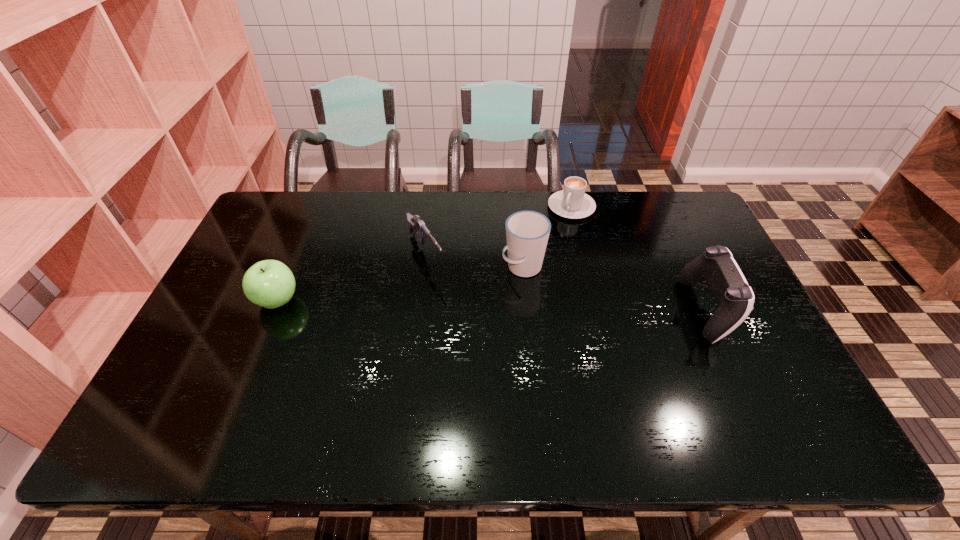
At what (x,y) coordinates should I click in order to perform the action: click on vacant space at the far edge. Please return your answer as a coordinate pair (x, y). This screenshot has width=960, height=540. Looking at the image, I should click on (396, 201).

In the image, there is a desktop. At what (x,y) coordinates should I click in order to perform the action: click on vacant space at the near edge. Please return your answer as a coordinate pair (x, y). Looking at the image, I should click on [563, 386].

Where is `vacant area at the right edge`? This screenshot has width=960, height=540. vacant area at the right edge is located at coordinates (704, 306).

This screenshot has height=540, width=960. Find the location of `vacant space at the far left corner`. vacant space at the far left corner is located at coordinates (266, 212).

Where is `free space at the near left corner of the desktop`? This screenshot has height=540, width=960. free space at the near left corner of the desktop is located at coordinates (185, 396).

You are a GUI agent. You are given a task and a screenshot of the screen. Output one action in this format:
    pyautogui.click(x=<x>, y=<y>)
    Task: Click on the free location at the far right corner
    This screenshot has height=540, width=960.
    Given the screenshot: What is the action you would take?
    pyautogui.click(x=675, y=196)

Identify the location of vacant space at the near right corner of the desktop. (728, 380).

I want to click on free point between the cappuccino and the gun, so click(498, 231).

The image size is (960, 540). Identify the location of free point between the shortest object and the apple. (424, 254).

You are a GUI agent. You are given a task and a screenshot of the screen. Output one action in this format:
    pyautogui.click(x=<x>, y=<y>)
    Task: Click on the blank region between the gun and the leftmost object
    This screenshot has height=540, width=960.
    Given the screenshot: What is the action you would take?
    pyautogui.click(x=351, y=278)